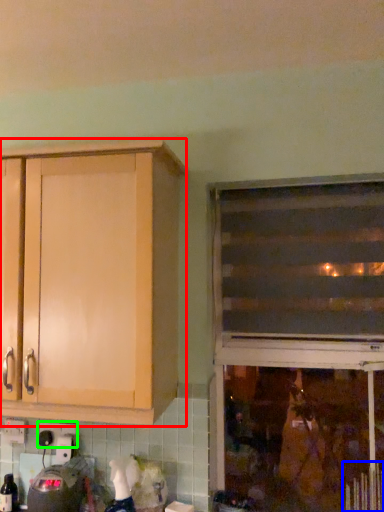
Question: Estimate the real-world distances between objects in this image. Which object is farther from cabinetry (highlighted by a red box), radiator (highlighted by a blue box) or electric outlet (highlighted by a green box)?

Choices:
 (A) radiator
 (B) electric outlet

Answer: (A)